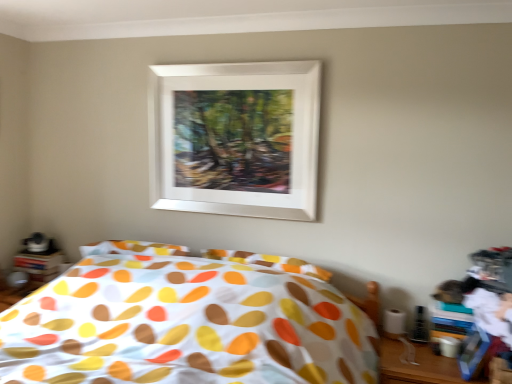
Question: Can you confirm if wooden table at lower right is thinner than polka dot fabric bed at center?

Choices:
 (A) yes
 (B) no

Answer: (A)

Question: Is wooden table at lower right oriented towards polka dot fabric bed at center?

Choices:
 (A) yes
 (B) no

Answer: (B)

Question: Is wooden table at lower right next to polka dot fabric bed at center and touching it?

Choices:
 (A) no
 (B) yes

Answer: (A)

Question: Is wooden table at lower right not near polka dot fabric bed at center?

Choices:
 (A) yes
 (B) no

Answer: (B)

Question: Is wooden table at lower right not inside polka dot fabric bed at center?

Choices:
 (A) no
 (B) yes

Answer: (B)

Question: Is wooden table at lower right positioned with its back to polka dot fabric bed at center?

Choices:
 (A) no
 (B) yes

Answer: (A)

Question: From the image's perspective, is white matte picture frame at upper center beneath polka dot fabric bed at center?

Choices:
 (A) yes
 (B) no

Answer: (B)

Question: Can you confirm if white matte picture frame at upper center is smaller than polka dot fabric bed at center?

Choices:
 (A) yes
 (B) no

Answer: (A)

Question: Does white matte picture frame at upper center come in front of polka dot fabric bed at center?

Choices:
 (A) no
 (B) yes

Answer: (A)

Question: Does white matte picture frame at upper center turn towards polka dot fabric bed at center?

Choices:
 (A) no
 (B) yes

Answer: (A)

Question: Considering the relative positions of white matte picture frame at upper center and polka dot fabric bed at center in the image provided, is white matte picture frame at upper center to the left of polka dot fabric bed at center from the viewer's perspective?

Choices:
 (A) yes
 (B) no

Answer: (B)

Question: Can you see white matte picture frame at upper center touching polka dot fabric bed at center?

Choices:
 (A) no
 (B) yes

Answer: (A)

Question: Is wooden table at lower right positioned beyond the bounds of white matte picture frame at upper center?

Choices:
 (A) yes
 (B) no

Answer: (A)